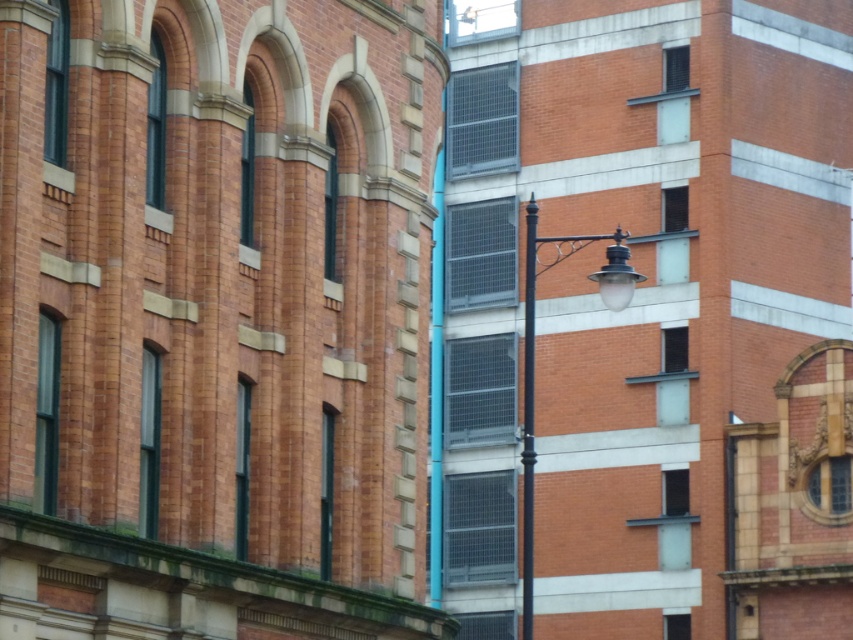
Question: Which of the following is the farthest from the observer?

Choices:
 (A) black wrought iron pole at center
 (B) black metal lamp post at center

Answer: (A)

Question: Which point is farther from the camera taking this photo?

Choices:
 (A) (532, 339)
 (B) (543, 237)

Answer: (B)

Question: Does black metal lamp post at center have a lesser width compared to black wrought iron pole at center?

Choices:
 (A) yes
 (B) no

Answer: (B)

Question: Is black metal lamp post at center smaller than black wrought iron pole at center?

Choices:
 (A) no
 (B) yes

Answer: (A)

Question: Which object is closer to the camera taking this photo?

Choices:
 (A) black wrought iron pole at center
 (B) black metal lamp post at center

Answer: (B)

Question: Does black metal lamp post at center have a greater width compared to black wrought iron pole at center?

Choices:
 (A) yes
 (B) no

Answer: (A)